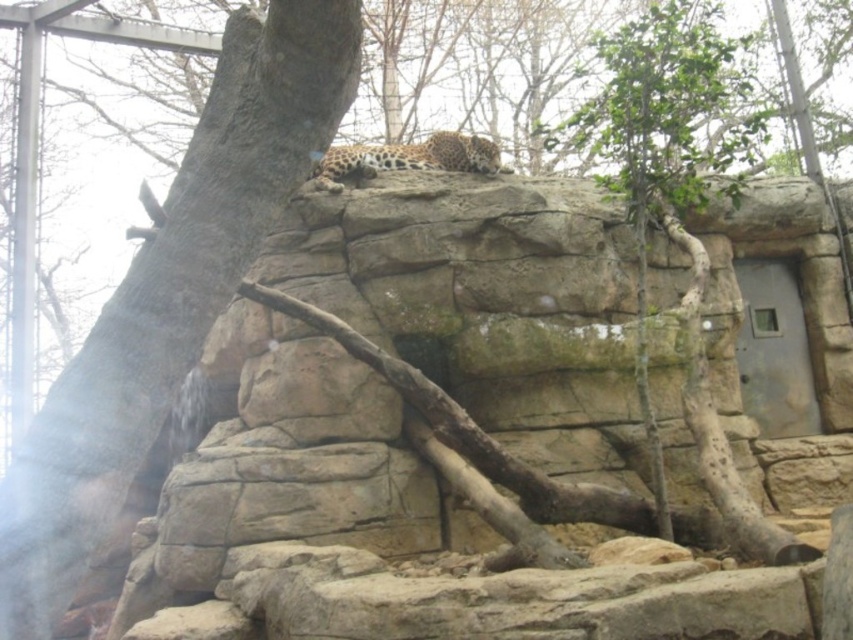
Question: Which point appears farthest from the camera in this image?

Choices:
 (A) (131, 305)
 (B) (624, 163)
 (C) (401, 148)

Answer: (B)

Question: Can you confirm if smooth gray tree trunk at upper left is thinner than spotted fur leopard at upper center?

Choices:
 (A) yes
 (B) no

Answer: (B)

Question: Is smooth gray tree trunk at upper left wider than green leafy tree at upper right?

Choices:
 (A) no
 (B) yes

Answer: (A)

Question: Can you confirm if smooth gray tree trunk at upper left is positioned below green leafy tree at upper right?

Choices:
 (A) no
 (B) yes

Answer: (B)

Question: Which object is the farthest from the green leafy tree at upper right?

Choices:
 (A) spotted fur leopard at upper center
 (B) smooth gray tree trunk at upper left

Answer: (B)

Question: Which point appears farthest from the camera in this image?

Choices:
 (A) (467, 170)
 (B) (602, 134)

Answer: (A)